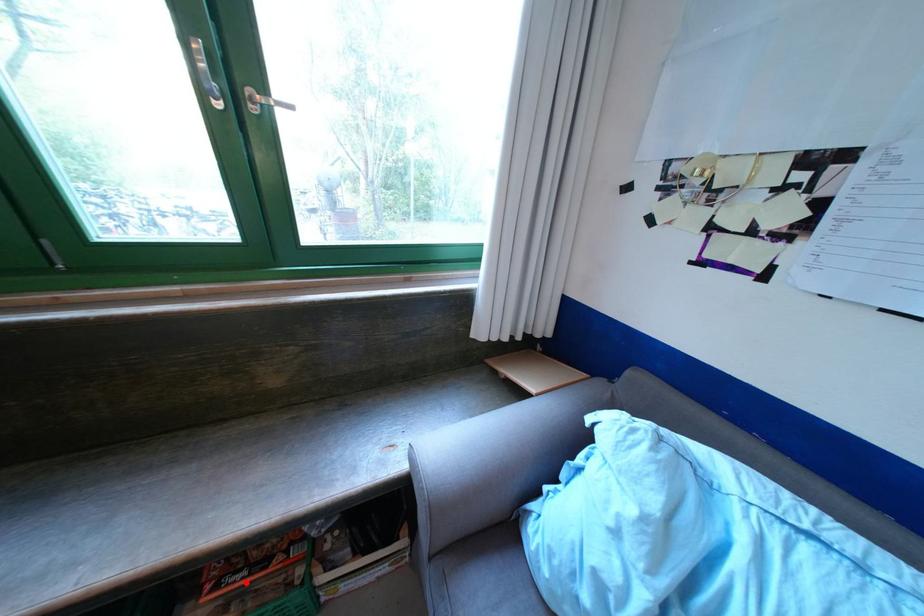
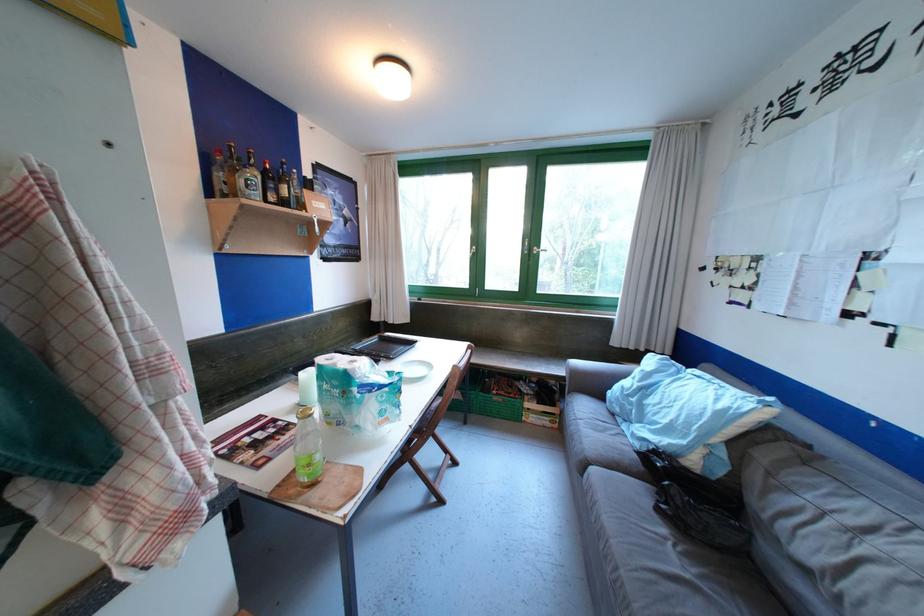
Question: I am providing you with two images of the same scene from different viewpoints. Image1 has a red point marked. In image2, the corresponding 3D location appears at what relative position? Reply with the corresponding letter.

Choices:
 (A) Closer
 (B) Farther

Answer: (B)